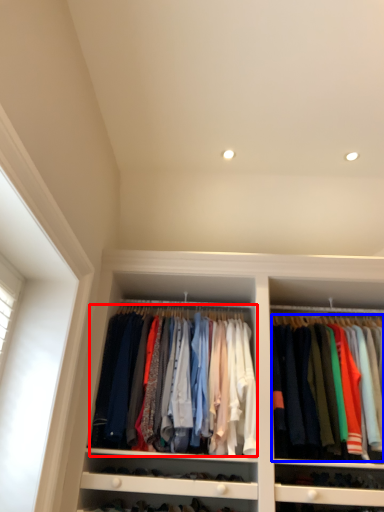
Question: Which object is further to the camera taking this photo, clothing (highlighted by a red box) or clothing (highlighted by a blue box)?

Choices:
 (A) clothing
 (B) clothing

Answer: (A)